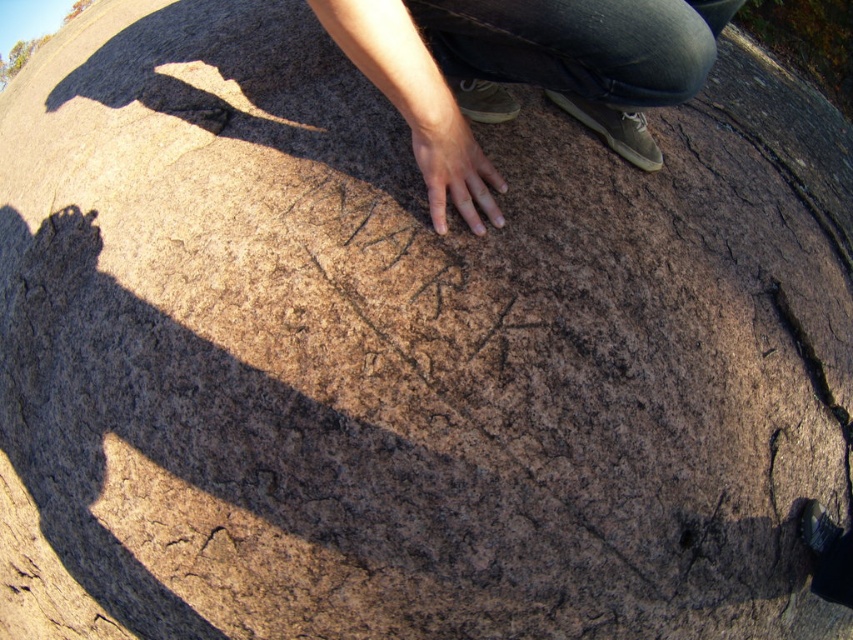
Is smooth tan skin at center smaller than smooth brown hand at center?

No.

Does smooth tan skin at center have a greater width compared to smooth brown hand at center?

Correct, the width of smooth tan skin at center exceeds that of smooth brown hand at center.

At what (x,y) coordinates should I click in order to perform the action: click on smooth tan skin at center. Please return your answer as a coordinate pair (x, y). Looking at the image, I should click on (521, 70).